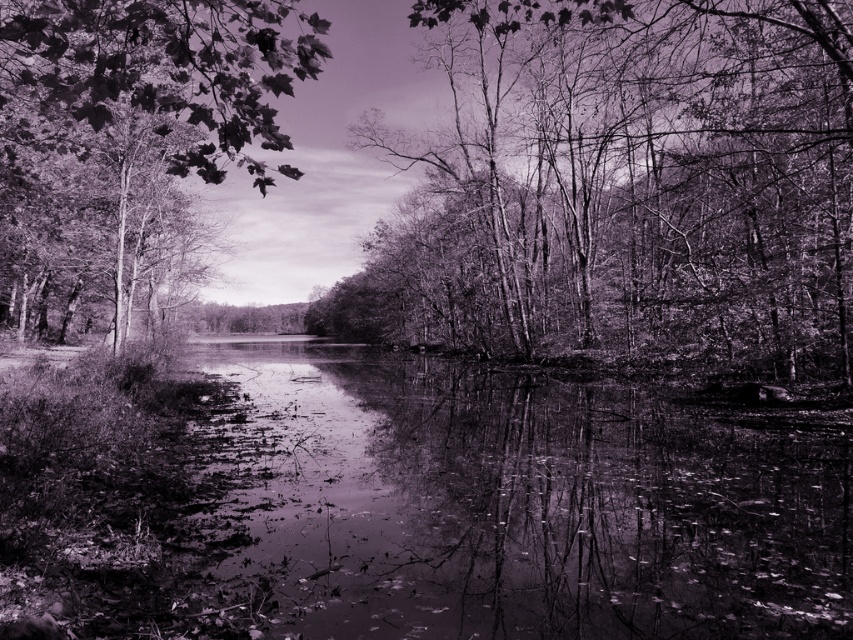
Between point (515, 45) and point (218, 28), which one is positioned in front?

Positioned in front is point (218, 28).

Which is more to the left, smooth bark trees at center or smooth bark tree at left?

smooth bark tree at left

What do you see at coordinates (625, 188) in the screenshot? The width and height of the screenshot is (853, 640). I see `smooth bark trees at center` at bounding box center [625, 188].

Where is `smooth bark trees at center`? The width and height of the screenshot is (853, 640). smooth bark trees at center is located at coordinates (625, 188).